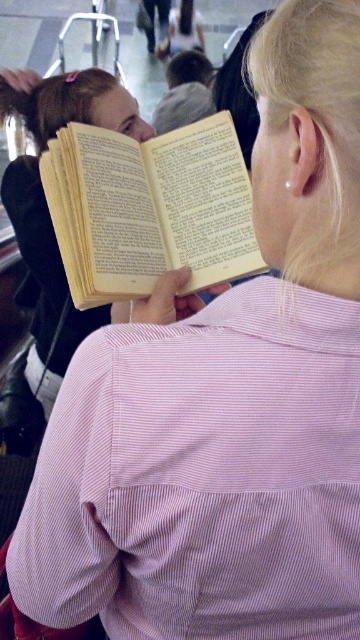
This screenshot has width=360, height=640. Describe the element at coordinates (203, 476) in the screenshot. I see `pink striped shirt at back` at that location.

In order to click on pink striped shirt at back in this screenshot , I will do `click(203, 476)`.

Identify the location of pink striped shirt at back. (203, 476).

Who is shorter, yellow paper book at center or yellow paper book at upper left?

Standing shorter between the two is yellow paper book at center.

I want to click on yellow paper book at center, so click(149, 209).

Does point (127, 259) lie in front of point (77, 328)?

Yes, point (127, 259) is in front of point (77, 328).

This screenshot has height=640, width=360. I want to click on yellow paper book at center, so (x=149, y=209).

Which is in front, point (32, 516) or point (123, 272)?

Point (32, 516) is in front.

Locate an element on the screen. Image resolution: width=360 pixels, height=640 pixels. pink striped shirt at back is located at coordinates (203, 476).